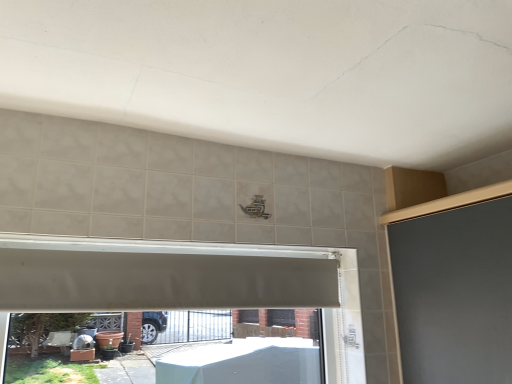
Describe the element at coordinates (187, 282) in the screenshot. The width and height of the screenshot is (512, 384). I see `white plastic window frame at center` at that location.

Locate an element on the screen. Image resolution: width=512 pixels, height=384 pixels. white plastic window frame at center is located at coordinates (187, 282).

What is the approximate height of white matte exhaust hood at center?

white matte exhaust hood at center is 8.14 inches in height.

What do you see at coordinates (161, 281) in the screenshot?
I see `white matte exhaust hood at center` at bounding box center [161, 281].

At what (x,y) coordinates should I click in order to perform the action: click on white matte exhaust hood at center. Please return your answer as a coordinate pair (x, y). Looking at the image, I should click on (161, 281).

Measure the distance between point (72,256) and camera.

They are 1.34 meters apart.

Identify the location of white plastic window frame at center. (187, 282).

Between white matte exhaust hood at center and white plastic window frame at center, which one appears on the right side from the viewer's perspective?

Positioned to the right is white matte exhaust hood at center.

Which is behind, white matte exhaust hood at center or white plastic window frame at center?

white matte exhaust hood at center is behind.

Which is farther, [266,279] or [290,263]?

The point [290,263] is farther.

From the image's perspective, would you say white matte exhaust hood at center is shown under white plastic window frame at center?

No.

From a real-world perspective, between white matte exhaust hood at center and white plastic window frame at center, who is vertically higher?

From a 3D spatial view, white matte exhaust hood at center is above.

In terms of width, does white matte exhaust hood at center look wider or thinner when compared to white plastic window frame at center?

Considering their sizes, white matte exhaust hood at center looks slimmer than white plastic window frame at center.

Considering the sizes of objects white matte exhaust hood at center and white plastic window frame at center in the image provided, who is shorter, white matte exhaust hood at center or white plastic window frame at center?

Standing shorter between the two is white matte exhaust hood at center.

Considering the sizes of white matte exhaust hood at center and white plastic window frame at center in the image, is white matte exhaust hood at center bigger or smaller than white plastic window frame at center?

white matte exhaust hood at center is smaller than white plastic window frame at center.

Is white plastic window frame at center located within white matte exhaust hood at center?

That's incorrect, white plastic window frame at center is not inside white matte exhaust hood at center.

Are white matte exhaust hood at center and white plastic window frame at center beside each other?

Yes, the surface of white matte exhaust hood at center is in contact with white plastic window frame at center.

Is white matte exhaust hood at center oriented away from white plastic window frame at center?

Yes, white matte exhaust hood at center is facing away from white plastic window frame at center.

What's the angular difference between white matte exhaust hood at center and white plastic window frame at center's facing directions?

white matte exhaust hood at center and white plastic window frame at center are facing 0.256 degrees away from each other.

Where is `exhaust hood that is on the right side of white plastic window frame at center`? The width and height of the screenshot is (512, 384). exhaust hood that is on the right side of white plastic window frame at center is located at coordinates (161, 281).

Based on their positions, is white plastic window frame at center located to the left or right of white matte exhaust hood at center?

From the image, it's evident that white plastic window frame at center is to the left of white matte exhaust hood at center.

Between white plastic window frame at center and white matte exhaust hood at center, which one is positioned behind?

white matte exhaust hood at center.

Is point (334, 305) closer or farther from the camera than point (311, 294)?

Clearly, point (334, 305) is more distant from the camera than point (311, 294).

From the image's perspective, is white plastic window frame at center over white matte exhaust hood at center?

No, from the image's perspective, white plastic window frame at center is not above white matte exhaust hood at center.

Based on the photo, from a real-world perspective, between white plastic window frame at center and white matte exhaust hood at center, who is vertically higher?

In real-world perspective, white matte exhaust hood at center is above.

Considering the sizes of objects white plastic window frame at center and white matte exhaust hood at center in the image provided, who is thinner, white plastic window frame at center or white matte exhaust hood at center?

white matte exhaust hood at center is thinner.

Considering the sizes of objects white plastic window frame at center and white matte exhaust hood at center in the image provided, who is taller, white plastic window frame at center or white matte exhaust hood at center?

Standing taller between the two is white plastic window frame at center.

Is white plastic window frame at center bigger than white matte exhaust hood at center?

Yes.

Is white plastic window frame at center outside of white matte exhaust hood at center?

white plastic window frame at center lies outside white matte exhaust hood at center's area.

Is white plastic window frame at center in contact with white matte exhaust hood at center?

Yes, white plastic window frame at center and white matte exhaust hood at center clearly make contact.

Is white plastic window frame at center facing away from white matte exhaust hood at center?

Correct, white plastic window frame at center is looking away from white matte exhaust hood at center.

This screenshot has width=512, height=384. I want to click on exhaust hood behind the white plastic window frame at center, so click(161, 281).

Find the location of `window frame on the left of the white matte exhaust hood at center`. window frame on the left of the white matte exhaust hood at center is located at coordinates (187, 282).

Image resolution: width=512 pixels, height=384 pixels. I want to click on window frame in front of the white matte exhaust hood at center, so click(x=187, y=282).